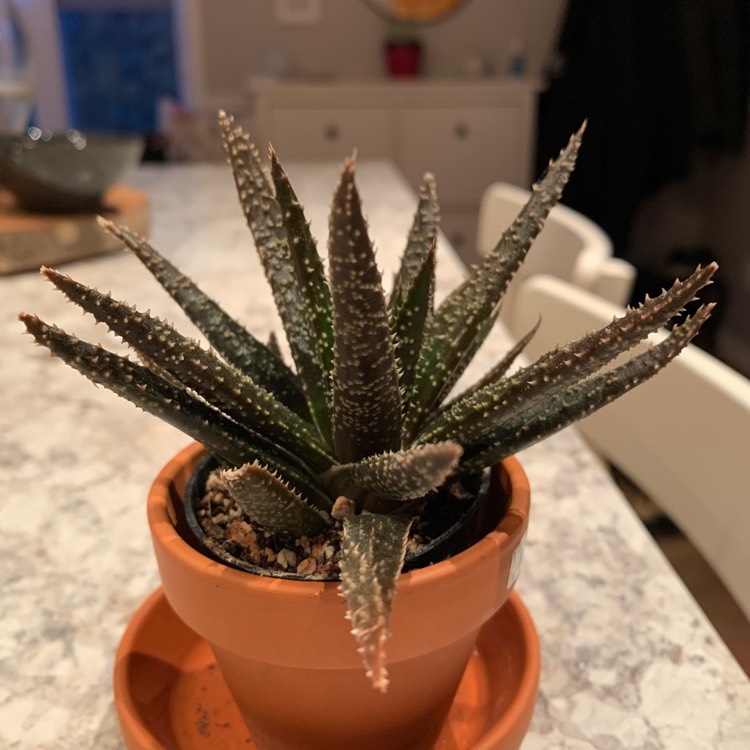
Find the location of a particular element. The image size is (750, 750). dish is located at coordinates (181, 714).